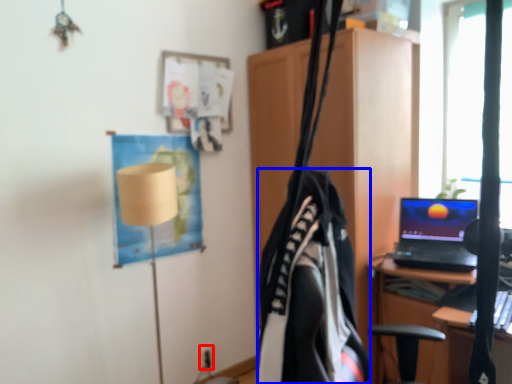
Question: Which of the following is the closest to the observer, electric outlet (highlighted by a red box) or clothing (highlighted by a blue box)?

Choices:
 (A) electric outlet
 (B) clothing

Answer: (B)